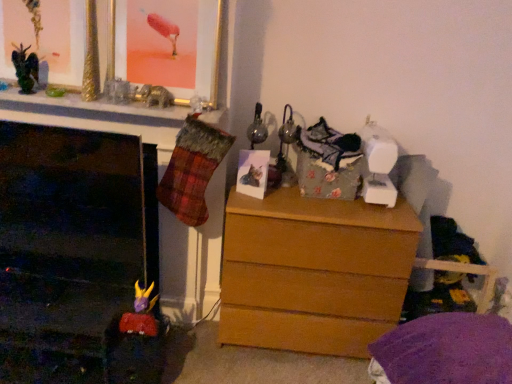
Question: In terms of width, does gold metallic picture frame at upper center, placed as the second picture frame when sorted from bottom to top, look wider or thinner when compared to matte paper photo at center, the 1th picture frame in the right-to-left sequence?

Choices:
 (A) wide
 (B) thin

Answer: (A)

Question: From the image's perspective, relative to matte paper photo at center, the 2th picture frame viewed from the top, is gold metallic picture frame at upper center, arranged as the first picture frame when viewed from the left, above or below?

Choices:
 (A) below
 (B) above

Answer: (B)

Question: Which object is the closest to the metallic black dragon at upper left?

Choices:
 (A) light brown wood chest of drawers at center
 (B) matte paper photo at center, which is the 2th picture frame in left-to-right order
 (C) gold metallic picture frame at upper center, marked as the first picture frame in a top-to-bottom arrangement

Answer: (C)

Question: Which is farther from the light brown wood chest of drawers at center?

Choices:
 (A) gold metallic picture frame at upper center, arranged as the first picture frame when viewed from the left
 (B) metallic black dragon at upper left
 (C) matte paper photo at center, the 1th picture frame in the right-to-left sequence

Answer: (B)